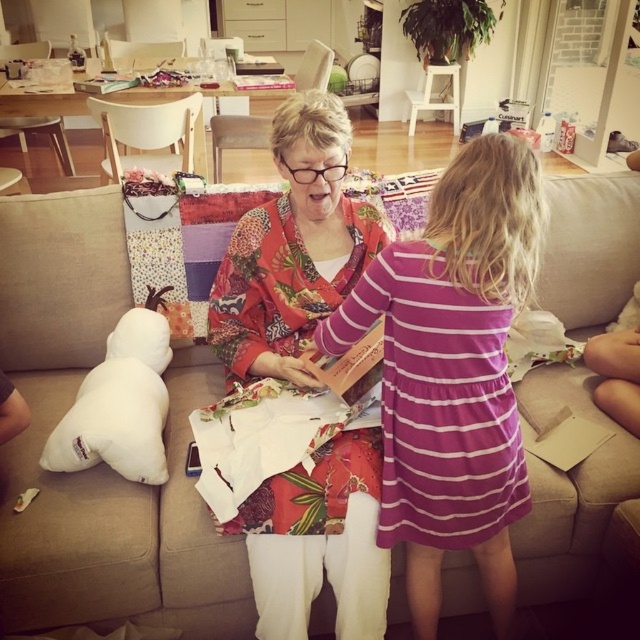
Based on the photo, you are a tailor who needs to sew a decorative trim along the edge of the floral fabric shawl at center and the white soft pillow at lower left. If your sewing machine can handle a maximum distance of 15 inches between items, can you place both items on your worktable without moving them closer?

The distance between the floral fabric shawl at center and the white soft pillow at lower left is 14.60 inches, which is under the 15 inch limit. Yes, you can place both items on your worktable without moving them closer.

From the picture: You are standing in the living room and want to place a small plant on the closest object to you between the beige fabric couch at center and the floral fabric shawl at center. Which object should you choose?

The beige fabric couch at center is closer to the viewer than the floral fabric shawl at center, so you should place the small plant on the beige fabric couch at center.

Based on the photo, you are standing in the living room and want to sit on the beige fabric couch at center. Based on its position, where should you walk towards to reach it?

The beige fabric couch at center is located at the coordinates point (100, 465), so you should walk towards the lower right area of the room to reach it.